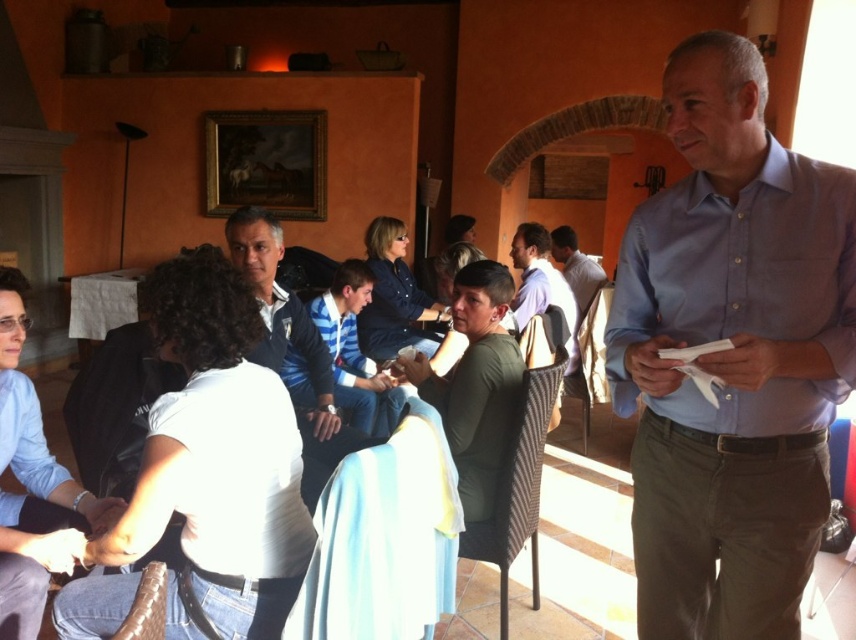
You are standing at the camera position and want to reach the point marked at coordinates (807, 348). Is this point within your immediate reach without moving your feet?

The point marked at coordinates (807, 348) is 1.40 meters away from the camera, so it is beyond immediate reach without moving your feet.

In the image, there is a man standing on the right side wearing a light blue shirt and dark trousers. He is holding some papers. There is also a point labeled as point (730,355) in the scene. Based on the coordinates, can you determine which object the point corresponds to?

The point (730,355) corresponds to the light blue button down shirt at upper right.